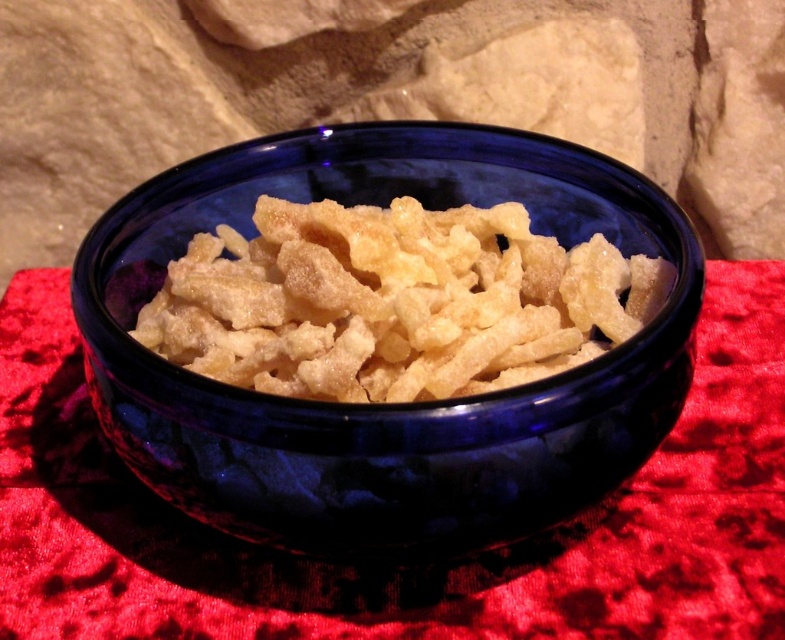
Is point (685, 240) closer to viewer compared to point (291, 241)?

Yes.

Does glossy ceramic bowl at center appear on the right side of matte yellow cereal at center?

In fact, glossy ceramic bowl at center is to the left of matte yellow cereal at center.

Locate an element on the screen. The width and height of the screenshot is (785, 640). glossy ceramic bowl at center is located at coordinates click(385, 404).